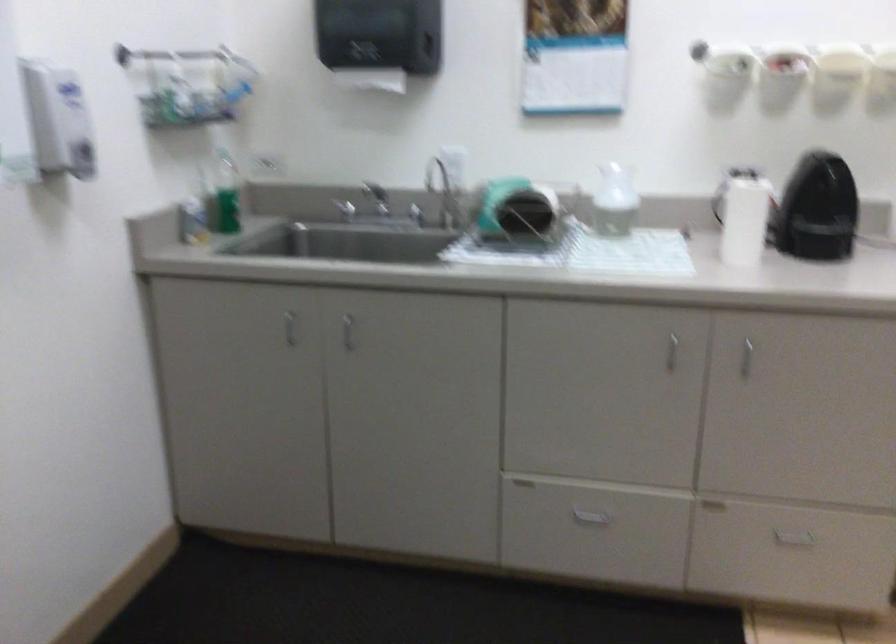
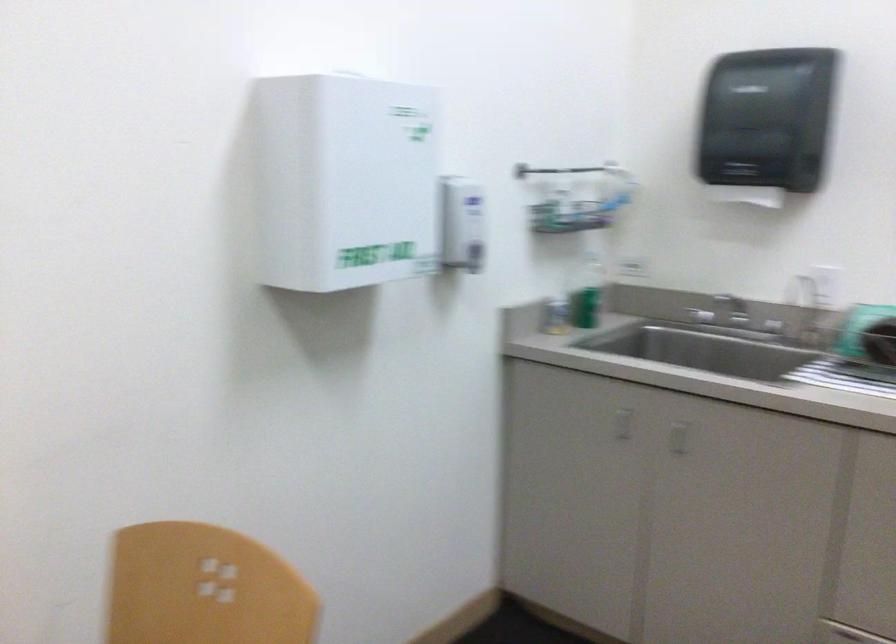
Question: The images are taken continuously from a first-person perspective. In which direction is your viewpoint rotating?

Choices:
 (A) Left
 (B) Right
 (C) Up
 (D) Down

Answer: (A)